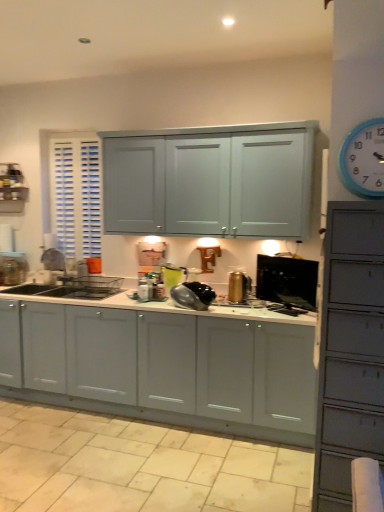
Locate an element on the screen. The height and width of the screenshot is (512, 384). vacant space underneath black glossy monitor at center, arranged as the fourth appliance when viewed from the left (from a real-world perspective) is located at coordinates (288, 311).